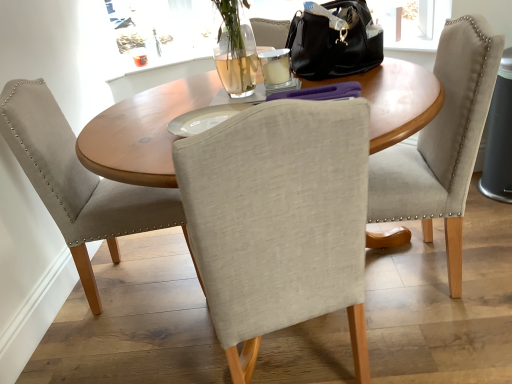
What are the coordinates of `vacant point to the right of wooden table at center` in the screenshot? It's located at (435, 336).